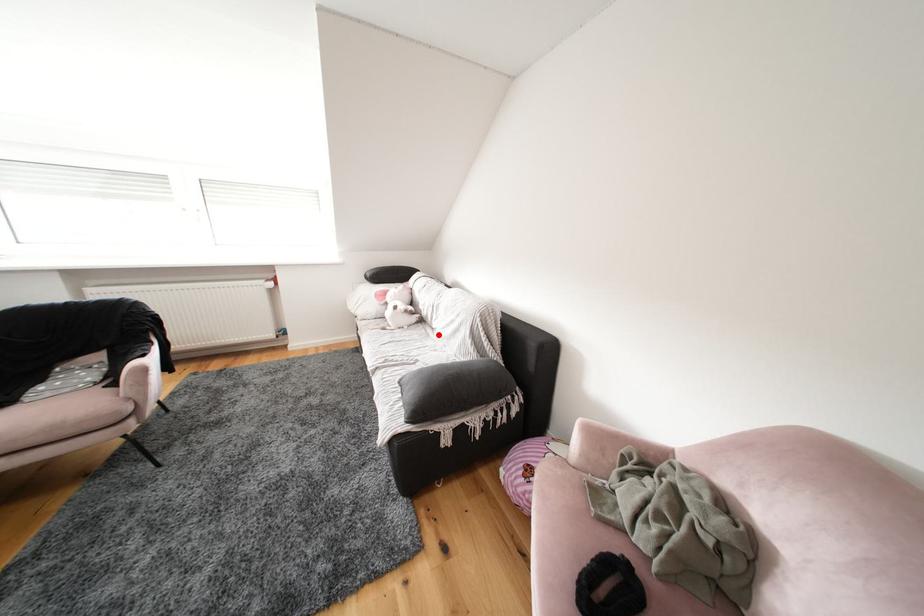
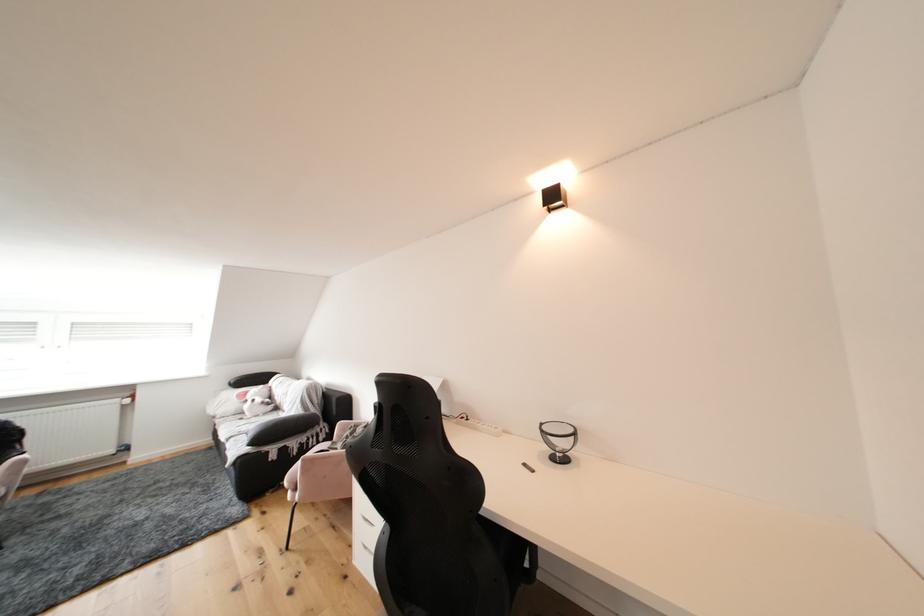
Locate, in the second image, the point that corresponds to the highlighted location in the first image.

(290, 416)